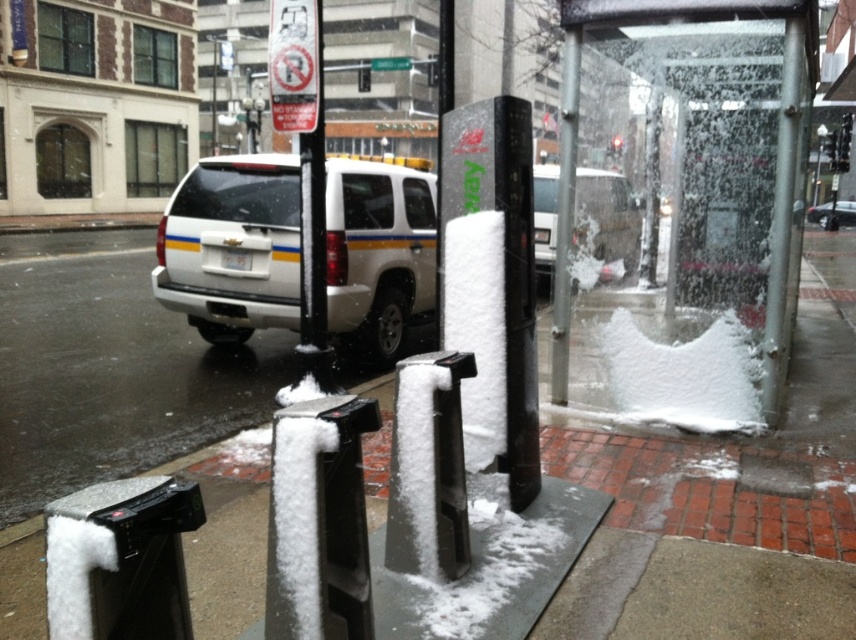
Question: Which of the following is the closest to the observer?

Choices:
 (A) (569, 74)
 (B) (584, 195)
 (C) (424, 250)

Answer: (A)

Question: Observing the image, what is the correct spatial positioning of white matte suv at center in reference to white matte suv at upper center?

Choices:
 (A) above
 (B) below

Answer: (B)

Question: Is white matte police van at center to the left of white matte suv at upper center from the viewer's perspective?

Choices:
 (A) yes
 (B) no

Answer: (A)

Question: Considering the real-world distances, which object is farthest from the transparent glass bus stop at center?

Choices:
 (A) white matte police van at center
 (B) white snow at lower left

Answer: (B)

Question: Does transparent glass bus stop at center lie in front of white frosted pole at center?

Choices:
 (A) yes
 (B) no

Answer: (A)

Question: Among these points, which one is nearest to the camera?

Choices:
 (A) (247, 392)
 (B) (623, 273)
 (C) (562, 387)
 (D) (379, 362)

Answer: (B)